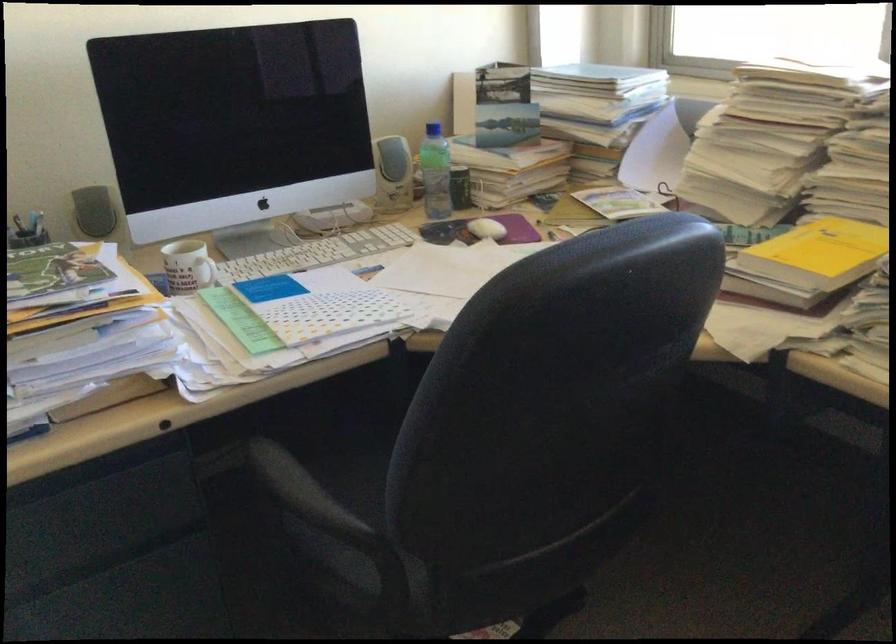
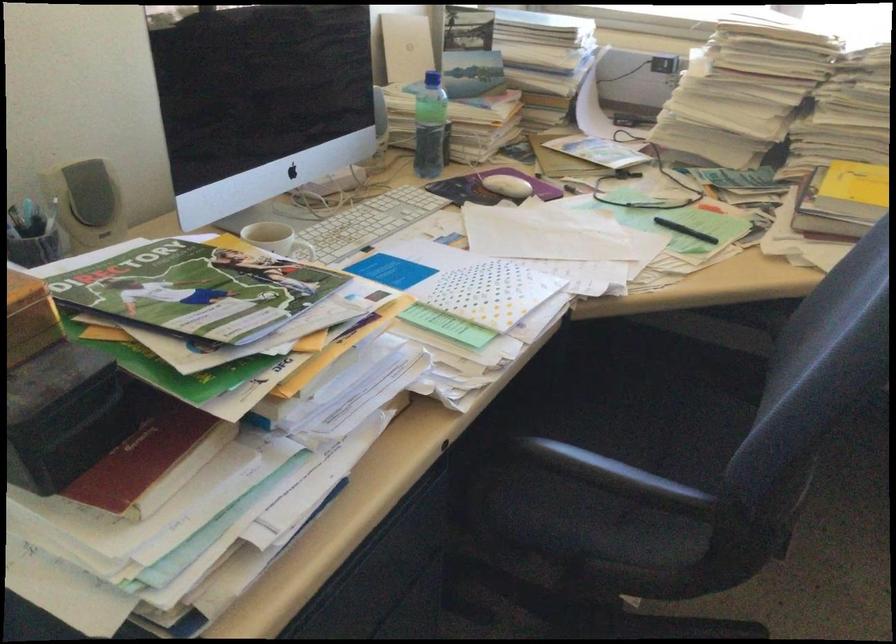
Question: The images are taken continuously from a first-person perspective. In which direction are you moving?

Choices:
 (A) Left
 (B) Right
 (C) Forward
 (D) Backward

Answer: (A)